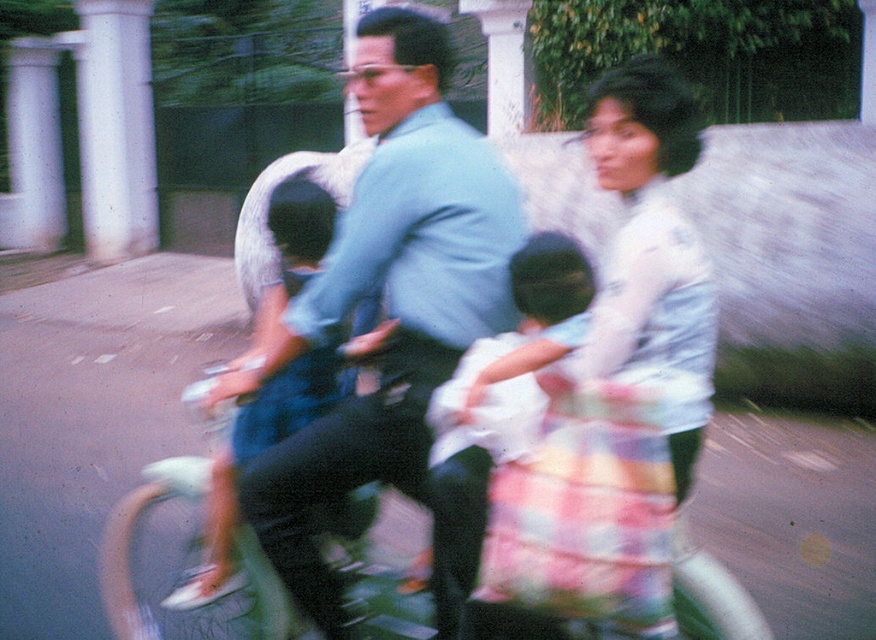
You are a photographer trying to capture a clear shot of the two people sitting on the tricycle. Since both the white satin blouse at center and the white cotton dress at center are in the center, which one is more to the right?

The white satin blouse at center is positioned on the right side of white cotton dress at center, so the white satin blouse at center is more to the right.

You are a photographer trying to capture a clear photo of the light blue shirt at center and the white cotton dress at center. Since the tricycle is moving, you need to focus your camera on the larger object first to ensure clarity. Which object should you focus on first?

The light blue shirt at center is larger in size than the white cotton dress at center, so you should focus on the light blue shirt at center first to ensure clarity.